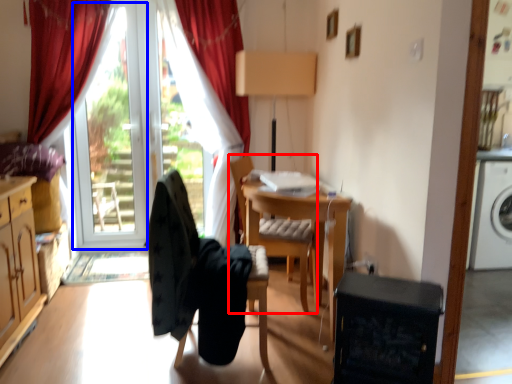
Question: Which object is further to the camera taking this photo, chair (highlighted by a red box) or window screen (highlighted by a blue box)?

Choices:
 (A) chair
 (B) window screen

Answer: (B)